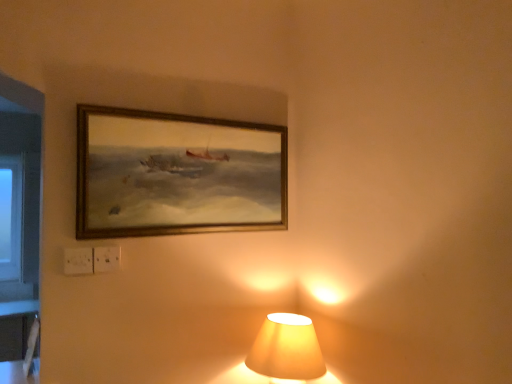
Question: From the image's perspective, is wooden frame at upper center positioned above or below matte yellow fabric lampshade at lower center?

Choices:
 (A) above
 (B) below

Answer: (A)

Question: Is point (157, 142) closer or farther from the camera than point (293, 362)?

Choices:
 (A) closer
 (B) farther

Answer: (B)

Question: Considering the positions of wooden frame at upper center and matte yellow fabric lampshade at lower center in the image, is wooden frame at upper center taller or shorter than matte yellow fabric lampshade at lower center?

Choices:
 (A) tall
 (B) short

Answer: (A)

Question: Considering the positions of matte yellow fabric lampshade at lower center and wooden frame at upper center in the image, is matte yellow fabric lampshade at lower center taller or shorter than wooden frame at upper center?

Choices:
 (A) tall
 (B) short

Answer: (B)

Question: Is matte yellow fabric lampshade at lower center to the left or to the right of wooden frame at upper center in the image?

Choices:
 (A) left
 (B) right

Answer: (B)

Question: Looking at the image, does matte yellow fabric lampshade at lower center seem bigger or smaller compared to wooden frame at upper center?

Choices:
 (A) big
 (B) small

Answer: (A)

Question: Considering their positions, is matte yellow fabric lampshade at lower center located in front of or behind wooden frame at upper center?

Choices:
 (A) behind
 (B) front

Answer: (B)